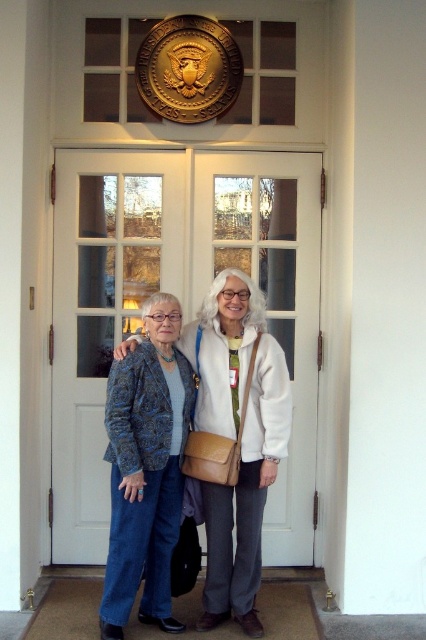
Question: Among these points, which one is farthest from the camera?

Choices:
 (A) (229, 572)
 (B) (154, 332)
 (C) (112, 262)

Answer: (C)

Question: Is white glossy door at center smaller than matte blue jacket at center?

Choices:
 (A) yes
 (B) no

Answer: (B)

Question: Estimate the real-world distances between objects in this image. Which object is farther from the matte blue jacket at center?

Choices:
 (A) blue textured blazer at lower left
 (B) white glossy door at center

Answer: (B)

Question: Is matte blue jacket at center to the left of blue textured blazer at lower left from the viewer's perspective?

Choices:
 (A) yes
 (B) no

Answer: (B)

Question: Where is matte blue jacket at center located in relation to blue textured blazer at lower left in the image?

Choices:
 (A) above
 (B) below

Answer: (A)

Question: Which point is farther to the camera?

Choices:
 (A) matte blue jacket at center
 (B) white glossy door at center
 (C) blue textured blazer at lower left

Answer: (B)